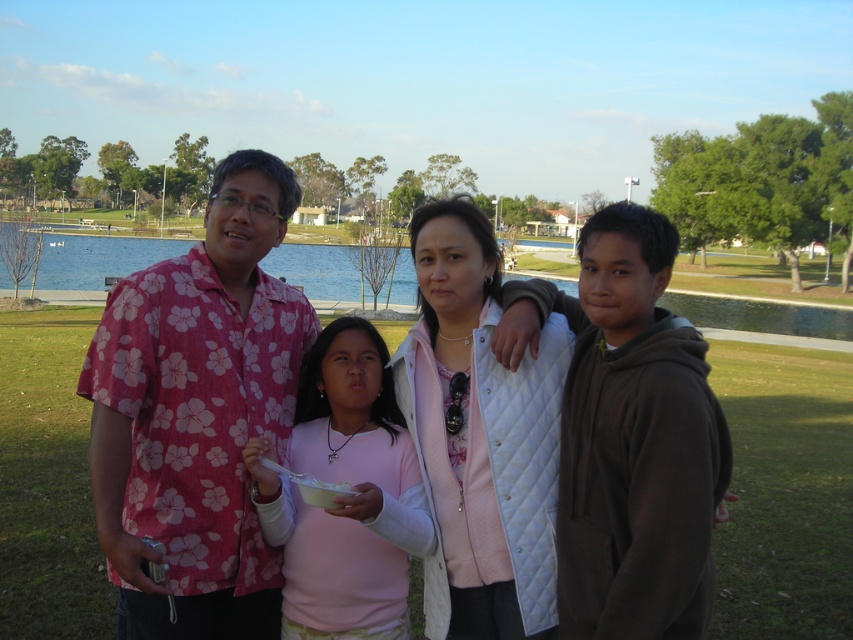
Question: Which object is the closest to the pink floral shirt at left?

Choices:
 (A) white quilted vest at center
 (B) pink fabric shirt at center
 (C) green water at center

Answer: (B)

Question: Is pink floral shirt at center positioned in front of green water at center?

Choices:
 (A) no
 (B) yes

Answer: (B)

Question: Which is farther from the green water at center?

Choices:
 (A) pink floral shirt at center
 (B) brown quilted jacket at right
 (C) white quilted vest at center

Answer: (C)

Question: Does brown quilted jacket at right appear under white quilted vest at center?

Choices:
 (A) no
 (B) yes

Answer: (A)

Question: Which of these objects is positioned closest to the brown quilted jacket at right?

Choices:
 (A) green water at center
 (B) pink fabric shirt at center
 (C) pink floral shirt at left
 (D) white quilted vest at center

Answer: (D)

Question: Considering the relative positions of pink floral shirt at center and brown quilted jacket at right in the image provided, where is pink floral shirt at center located with respect to brown quilted jacket at right?

Choices:
 (A) left
 (B) right

Answer: (A)